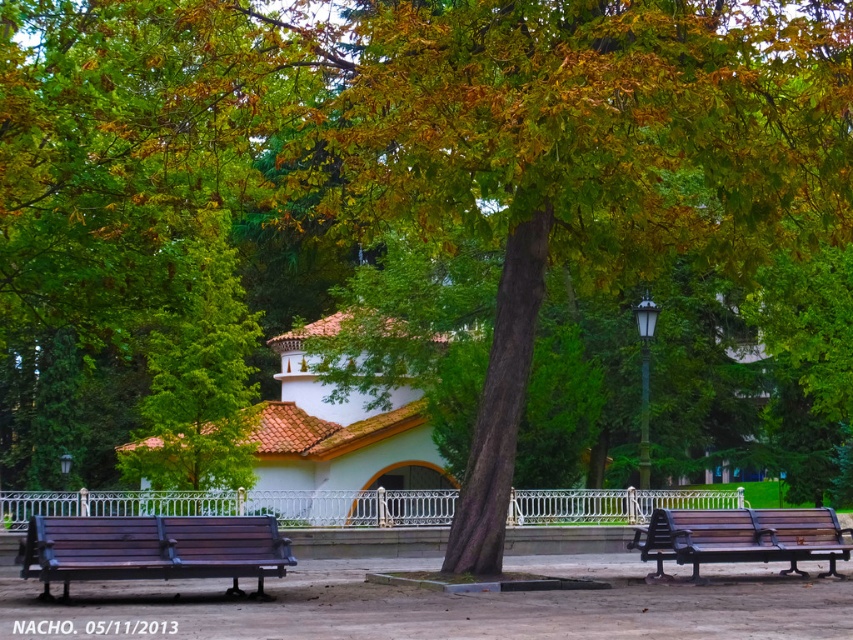
Question: Based on their relative distances, which object is nearer to the wooden bench at lower left?

Choices:
 (A) white matte chapel at center
 (B) brown wooden bench at right

Answer: (B)

Question: Can you confirm if wooden bench at lower left is positioned to the left of brown wooden bench at right?

Choices:
 (A) no
 (B) yes

Answer: (B)

Question: Among these objects, which one is farthest from the camera?

Choices:
 (A) white matte chapel at center
 (B) brown wooden bench at right
 (C) wooden bench at lower left

Answer: (A)

Question: Does white matte chapel at center have a smaller size compared to wooden bench at lower left?

Choices:
 (A) yes
 (B) no

Answer: (B)

Question: Which point is farther to the camera?

Choices:
 (A) wooden bench at lower left
 (B) brown wooden bench at right
 (C) white matte chapel at center

Answer: (C)

Question: Can you confirm if wooden bench at lower left is thinner than brown wooden bench at right?

Choices:
 (A) no
 (B) yes

Answer: (B)